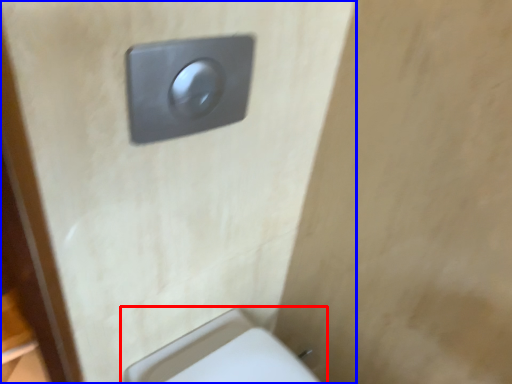
Question: Which of the following is the farthest to the observer, toilet (highlighted by a red box) or door (highlighted by a blue box)?

Choices:
 (A) toilet
 (B) door

Answer: (A)